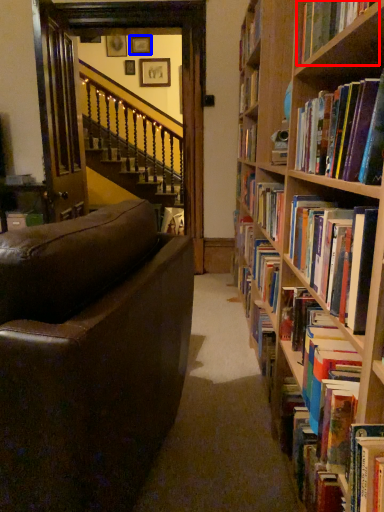
Question: Which object is closer to the camera taking this photo, book (highlighted by a red box) or picture frame (highlighted by a blue box)?

Choices:
 (A) book
 (B) picture frame

Answer: (A)